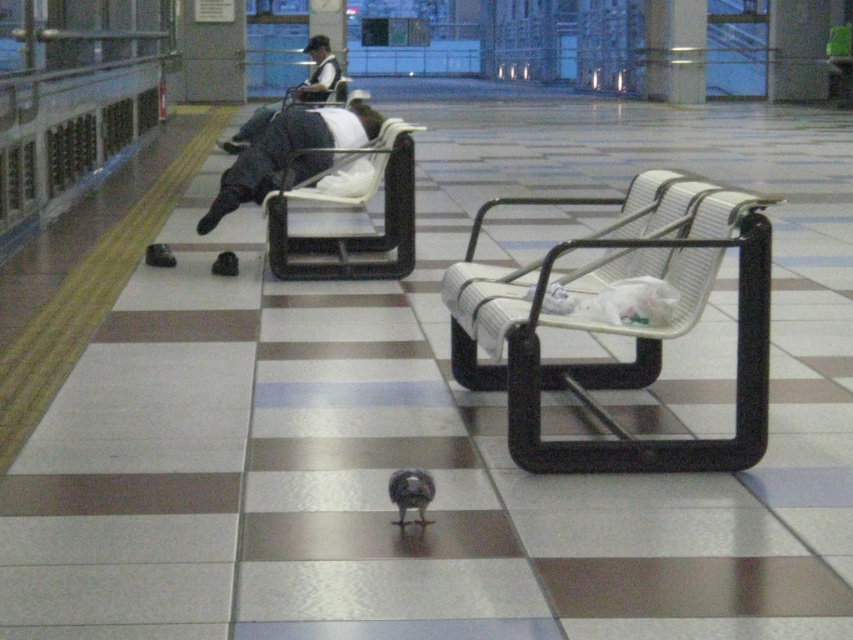
You are a traveler who just noticed your dark gray fabric bag at center and dark gray fabric jacket at upper center in the waiting area. Which item is positioned closer to the right side of the scene?

The dark gray fabric bag at center is to the right of the dark gray fabric jacket at upper center, so the dark gray fabric bag at center is closer to the right side of the scene.

You are a traveler with a large backpack and need to sit down in the waiting area. There are two seating options available. Which one between the white woven bench at center and the white fabric chair at center would allow you to sit comfortably with your backpack beside you?

The white woven bench at center is wider than the white fabric chair at center, so you can sit comfortably with your backpack beside you on the white woven bench at center.